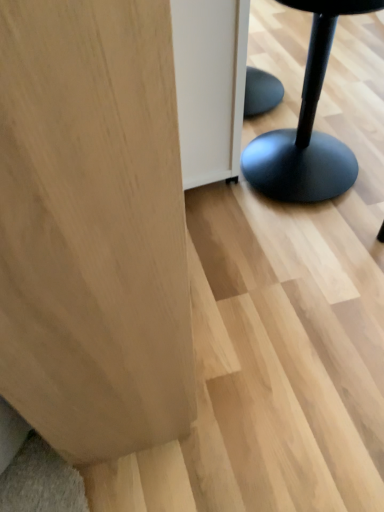
Question: Would you say black matte stool at right is outside natural wood plywood at lower left?

Choices:
 (A) no
 (B) yes

Answer: (B)

Question: Does black matte stool at right have a smaller size compared to natural wood plywood at lower left?

Choices:
 (A) yes
 (B) no

Answer: (A)

Question: From a real-world perspective, is black matte stool at right over natural wood plywood at lower left?

Choices:
 (A) yes
 (B) no

Answer: (B)

Question: Is black matte stool at right to the left of natural wood plywood at lower left from the viewer's perspective?

Choices:
 (A) yes
 (B) no

Answer: (B)

Question: From a real-world perspective, is black matte stool at right positioned under natural wood plywood at lower left based on gravity?

Choices:
 (A) yes
 (B) no

Answer: (A)

Question: Does black matte stool at right have a larger size compared to natural wood plywood at lower left?

Choices:
 (A) no
 (B) yes

Answer: (A)

Question: Is natural wood plywood at lower left facing away from black matte stool at right?

Choices:
 (A) yes
 (B) no

Answer: (B)

Question: Does natural wood plywood at lower left touch black matte stool at right?

Choices:
 (A) yes
 (B) no

Answer: (B)

Question: Is natural wood plywood at lower left taller than black matte stool at right?

Choices:
 (A) yes
 (B) no

Answer: (A)

Question: Is natural wood plywood at lower left completely or partially outside of black matte stool at right?

Choices:
 (A) no
 (B) yes

Answer: (B)

Question: Does natural wood plywood at lower left have a larger size compared to black matte stool at right?

Choices:
 (A) yes
 (B) no

Answer: (A)

Question: From a real-world perspective, does natural wood plywood at lower left sit lower than black matte stool at right?

Choices:
 (A) yes
 (B) no

Answer: (B)

Question: Does point (1, 90) appear closer or farther from the camera than point (327, 160)?

Choices:
 (A) closer
 (B) farther

Answer: (A)